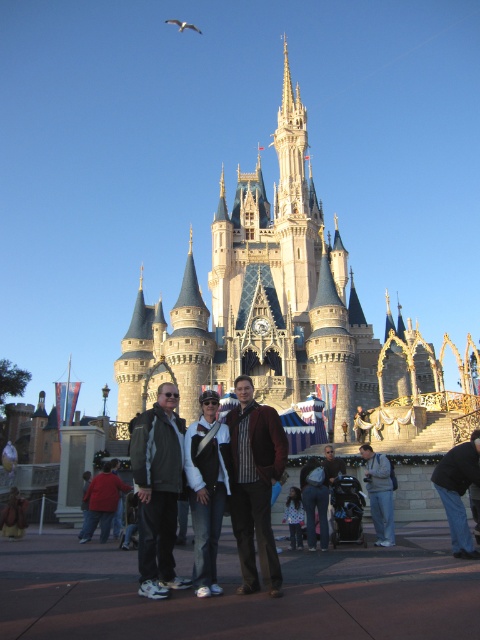
Describe the element at coordinates (282, 310) in the screenshot. I see `blue stone castle at center` at that location.

Consider the image. Can you confirm if blue stone castle at center is positioned to the right of denim jacket at center?

Yes, blue stone castle at center is to the right of denim jacket at center.

Is point (226, 216) positioned after point (202, 566)?

Yes, point (226, 216) is farther from viewer.

The height and width of the screenshot is (640, 480). I want to click on blue stone castle at center, so click(x=282, y=310).

Does point (404, 340) lie behind point (235, 461)?

Yes, it is behind point (235, 461).

Is blue stone castle at center above brown leather jacket at center?

Yes, blue stone castle at center is above brown leather jacket at center.

Where is `blue stone castle at center`? blue stone castle at center is located at coordinates (282, 310).

Can you confirm if dark gray jacket at center is taller than denim jacket at center?

Correct, dark gray jacket at center is much taller as denim jacket at center.

Is point (144, 458) positioned in front of point (216, 502)?

Yes, it is in front of point (216, 502).

The width and height of the screenshot is (480, 640). Find the location of `dark gray jacket at center`. dark gray jacket at center is located at coordinates (157, 490).